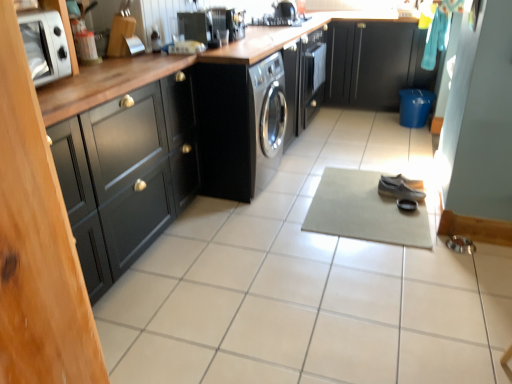
Where is `vacant space situated on the left part of beige fabric yoga mat at center`? This screenshot has height=384, width=512. vacant space situated on the left part of beige fabric yoga mat at center is located at coordinates (266, 215).